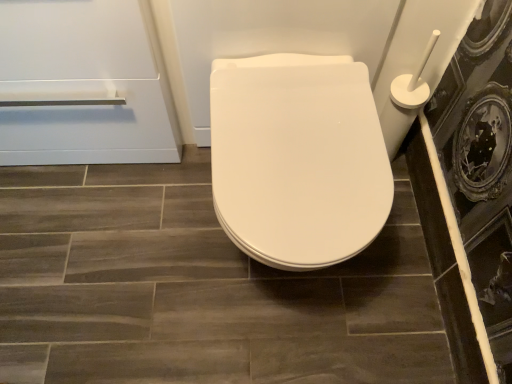
Where is `blank space to the left of white glossy toilet seat at center`? blank space to the left of white glossy toilet seat at center is located at coordinates (150, 249).